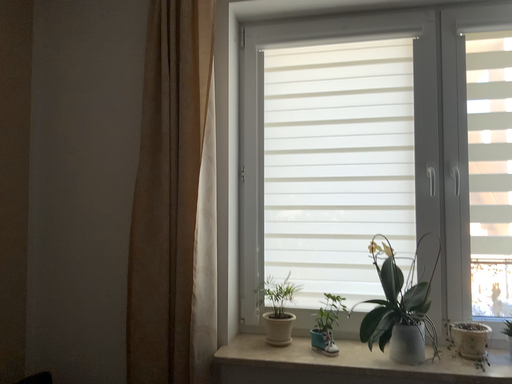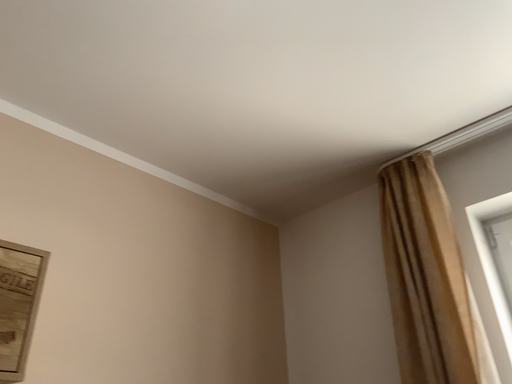
Question: How did the camera likely rotate when shooting the video?

Choices:
 (A) rotated upward
 (B) rotated downward

Answer: (A)